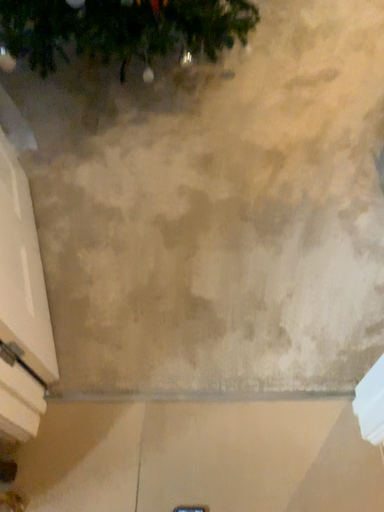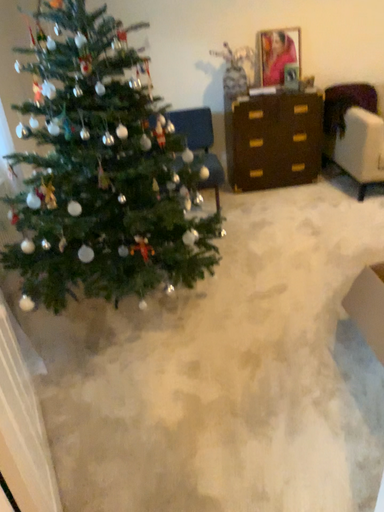
Question: How did the camera likely rotate when shooting the video?

Choices:
 (A) rotated downward
 (B) rotated upward

Answer: (B)